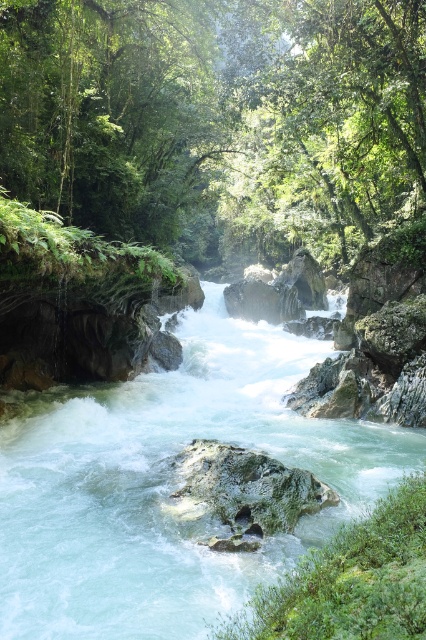
You are a hiker standing at the edge of the river and want to cross it. You see the translucent white water at center and the green mossy rock at center. Which one is higher above the water level?

The translucent white water at center has a greater height compared to the green mossy rock at center, so the translucent white water at center is higher above the water level.

You are a bird flying over the forest and want to land on the green leafy tree at center. Can you see the point at coordinates (x=216, y=118) on the tree?

Yes, the point at coordinates (x=216, y=118) is located on the green leafy tree at center, so you can see it there.

You are a hiker standing on the trail and looking at the green leafy tree at center and the translucent white water at center. Which object is closer to you?

The green leafy tree at center is closer to you because the translucent white water at center is behind it.